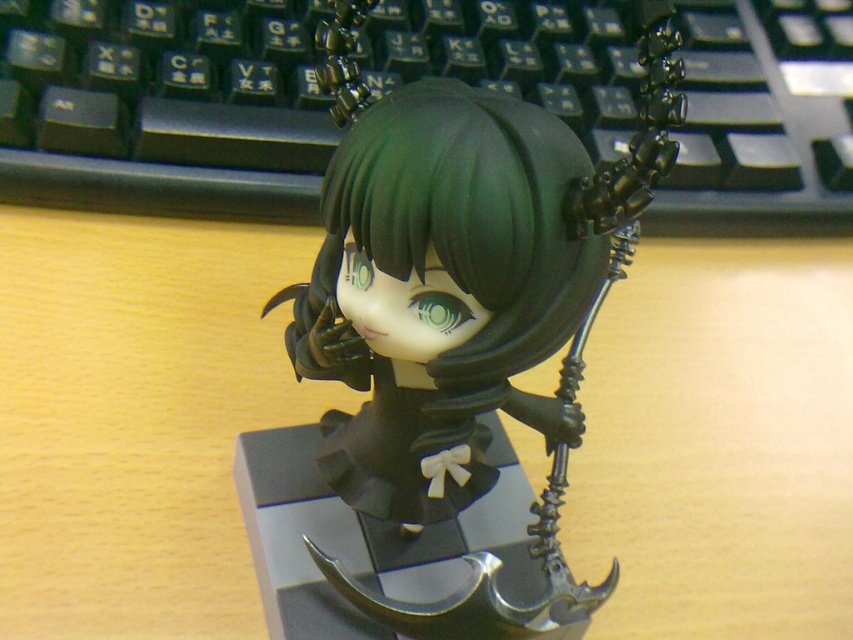
Question: Which point is closer to the camera taking this photo?

Choices:
 (A) (676, 124)
 (B) (834, 104)

Answer: (A)

Question: Does black plastic keyboard at upper center have a lesser width compared to matte black figurine at center?

Choices:
 (A) no
 (B) yes

Answer: (A)

Question: Is black plastic keyboard at upper center to the left of matte black figurine at center from the viewer's perspective?

Choices:
 (A) no
 (B) yes

Answer: (A)

Question: Which of the following is the farthest from the observer?

Choices:
 (A) black plastic keyboard at upper center
 (B) matte black figurine at center

Answer: (A)

Question: Among these objects, which one is nearest to the camera?

Choices:
 (A) black plastic keyboard at upper center
 (B) matte black figurine at center

Answer: (B)

Question: Can you confirm if black plastic keyboard at upper center is thinner than matte black figurine at center?

Choices:
 (A) no
 (B) yes

Answer: (A)